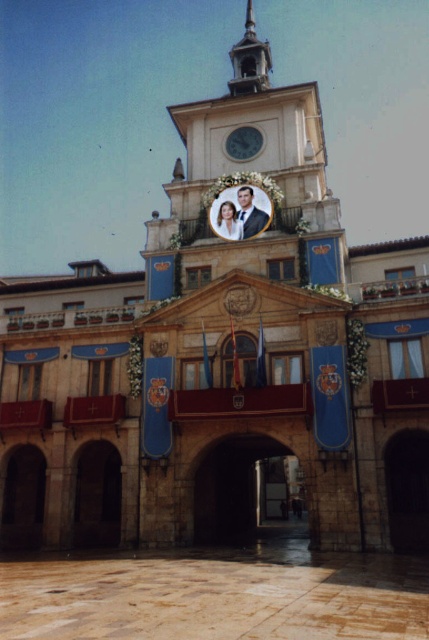
Question: Which of these objects is positioned closest to the metallic clock face at center?

Choices:
 (A) smooth stone clock tower at center
 (B) polished wood spire at upper center

Answer: (A)

Question: Which object appears closest to the camera in this image?

Choices:
 (A) polished wood spire at upper center
 (B) smooth stone clock tower at center

Answer: (B)

Question: Which object is the farthest from the metallic clock face at center?

Choices:
 (A) smooth stone clock tower at center
 (B) polished wood spire at upper center

Answer: (B)

Question: Is smooth stone clock tower at center to the left of polished wood spire at upper center from the viewer's perspective?

Choices:
 (A) yes
 (B) no

Answer: (A)

Question: Does smooth stone clock tower at center appear over polished wood spire at upper center?

Choices:
 (A) no
 (B) yes

Answer: (A)

Question: Does polished wood spire at upper center appear over metallic clock face at center?

Choices:
 (A) yes
 (B) no

Answer: (A)